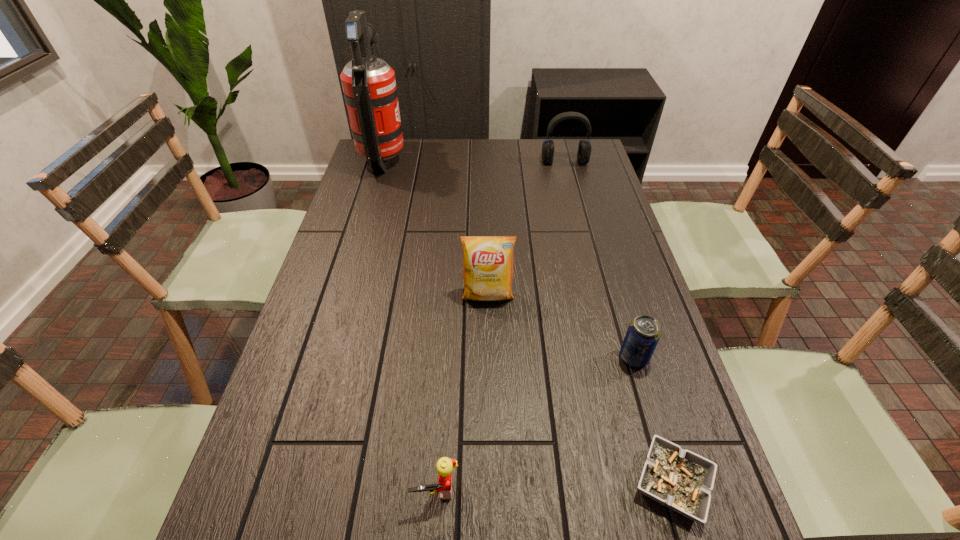
Image resolution: width=960 pixels, height=540 pixels. I want to click on vacant area between the leftmost object and the Lego, so click(410, 324).

This screenshot has width=960, height=540. Find the location of `unoccupied area between the headset and the Lego`. unoccupied area between the headset and the Lego is located at coordinates (500, 325).

Image resolution: width=960 pixels, height=540 pixels. Identify the location of vacant space that is in between the fourth nearest object and the Lego. (462, 392).

The height and width of the screenshot is (540, 960). I want to click on object that is the third closest to the leftmost object, so [644, 332].

Locate an element on the screen. This screenshot has height=540, width=960. object that can be found as the second closest to the fourth farthest object is located at coordinates (487, 260).

I want to click on vacant space that satisfies the following two spatial constraints: 1. on the front-facing side of the third farthest object; 2. on the right side of the soda, so click(489, 357).

Where is `free spot that satisfies the following two spatial constraints: 1. on the headband of the ashtray; 2. on the left side of the headset`? The height and width of the screenshot is (540, 960). free spot that satisfies the following two spatial constraints: 1. on the headband of the ashtray; 2. on the left side of the headset is located at coordinates (648, 483).

The width and height of the screenshot is (960, 540). In order to click on free spot that satisfies the following two spatial constraints: 1. on the front-facing side of the fourth farthest object; 2. on the left side of the fourth nearest object in this screenshot , I will do `click(489, 357)`.

Image resolution: width=960 pixels, height=540 pixels. In order to click on vacant region that satisfies the following two spatial constraints: 1. on the back side of the shortest object; 2. on the front label side of the fire extinguisher in this screenshot , I will do `click(576, 159)`.

Where is `free space that satisfies the following two spatial constraints: 1. on the front label side of the soda; 2. on the left side of the leftmost object`? The width and height of the screenshot is (960, 540). free space that satisfies the following two spatial constraints: 1. on the front label side of the soda; 2. on the left side of the leftmost object is located at coordinates (324, 357).